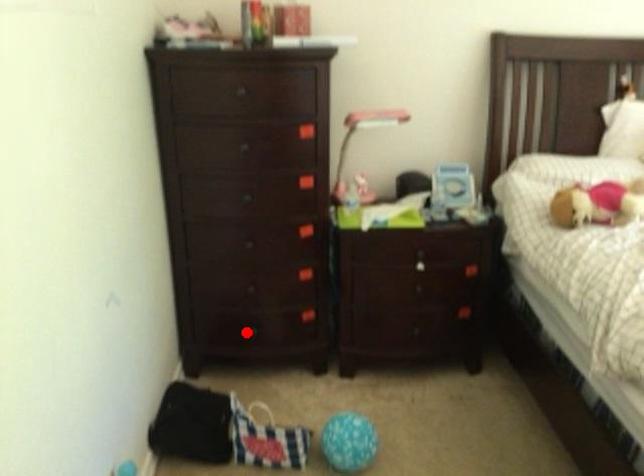
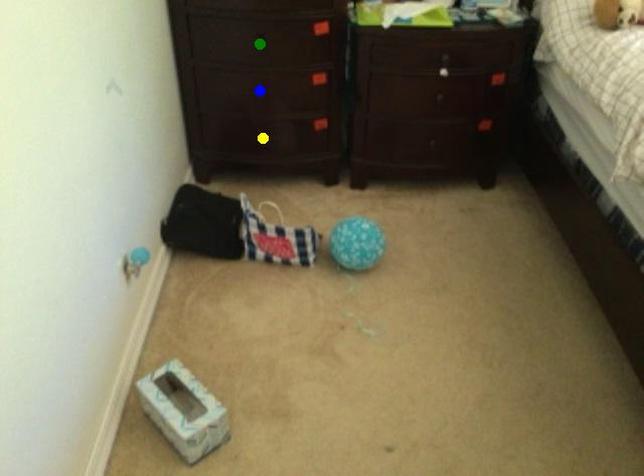
Question: I am providing you with two images of the same scene from different viewpoints. A red point is marked on the first image. You are given multiple points on the second image. Which point in image 2 is actually the same real-world point as the red point in image 1?

Choices:
 (A) yellow point
 (B) green point
 (C) blue point

Answer: (A)